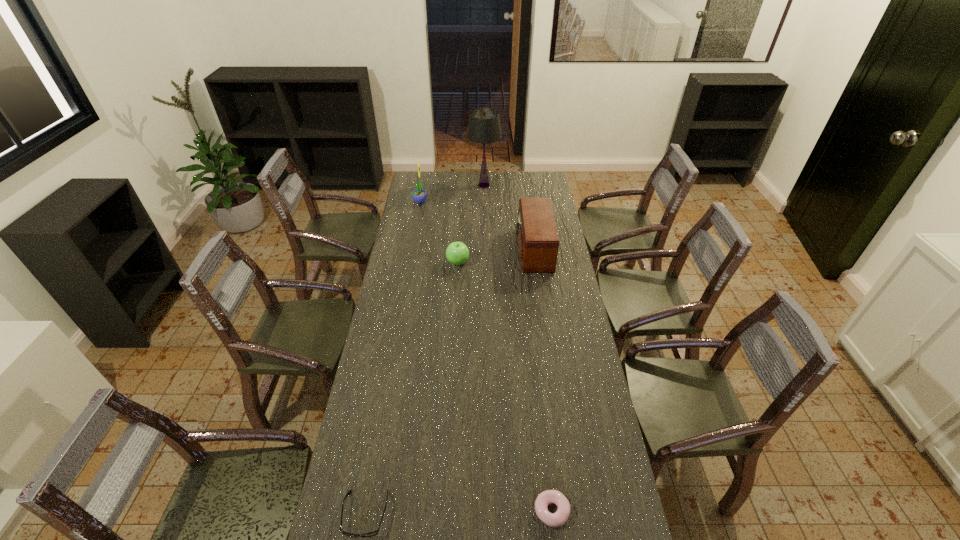
Image resolution: width=960 pixels, height=540 pixels. Identify the location of the fifth closest object relative to the spectacles. (484, 127).

The image size is (960, 540). Identify the location of vacant position in the image that satisfies the following two spatial constraints: 1. on the front-facing side of the fourth shortest object; 2. on the front side of the apple. (535, 262).

Where is `vacant region that satisfies the following two spatial constraints: 1. on the front-facing side of the doughnut; 2. on the left side of the farthest object`? The width and height of the screenshot is (960, 540). vacant region that satisfies the following two spatial constraints: 1. on the front-facing side of the doughnut; 2. on the left side of the farthest object is located at coordinates (489, 510).

At what (x,y) coordinates should I click in order to perform the action: click on vacant space that satisfies the following two spatial constraints: 1. on the front-facing side of the second tallest object; 2. on the right side of the apple. Please return your answer as a coordinate pair (x, y). Looking at the image, I should click on (409, 262).

Locate an element on the screen. vacant area in the image that satisfies the following two spatial constraints: 1. on the front-facing side of the fifth nearest object; 2. on the left side of the apple is located at coordinates (409, 262).